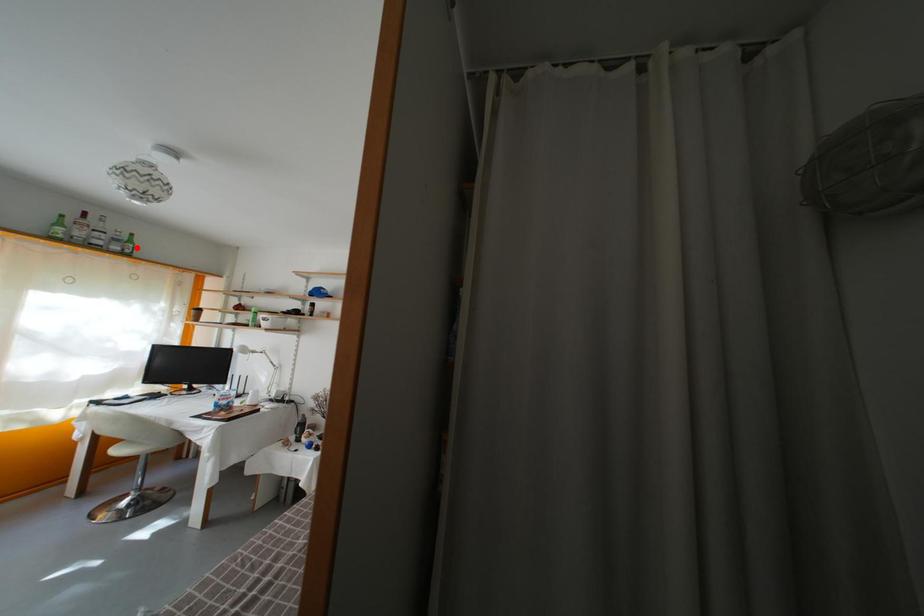
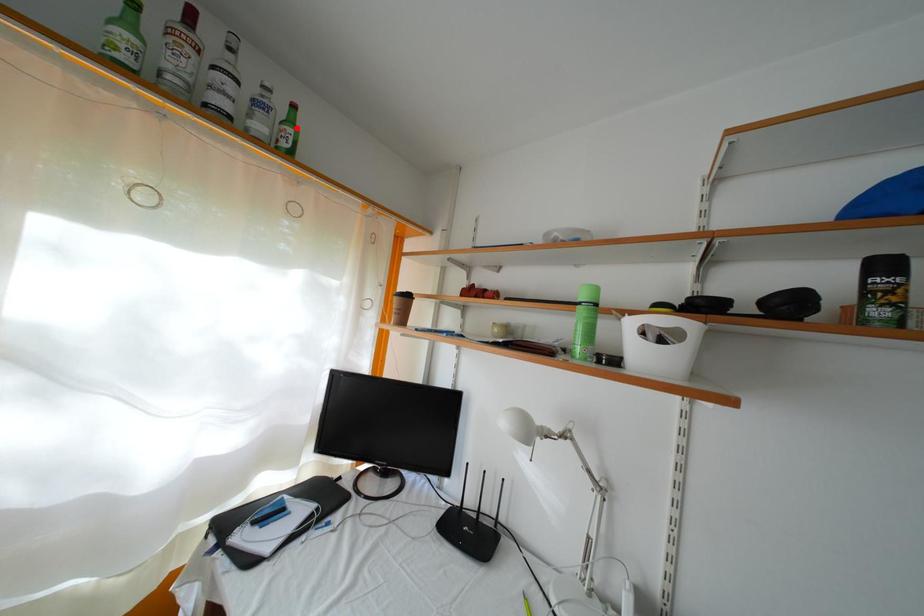
I am providing you with two images of the same scene from different viewpoints. A red point is marked on the first image and another point is marked on the second image. Do the highlighted points in image1 and image2 indicate the same real-world spot?

Yes